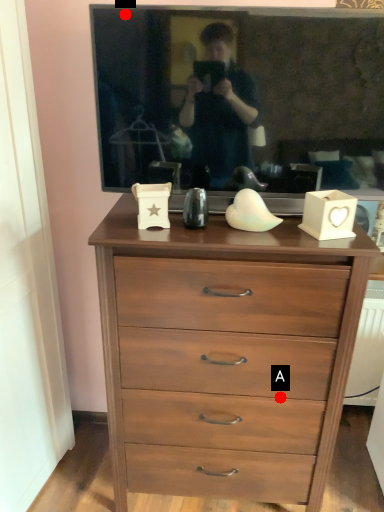
Question: Two points are circled on the image, labeled by A and B beside each circle. Among these points, which one is nearest to the camera?

Choices:
 (A) A is closer
 (B) B is closer

Answer: (B)